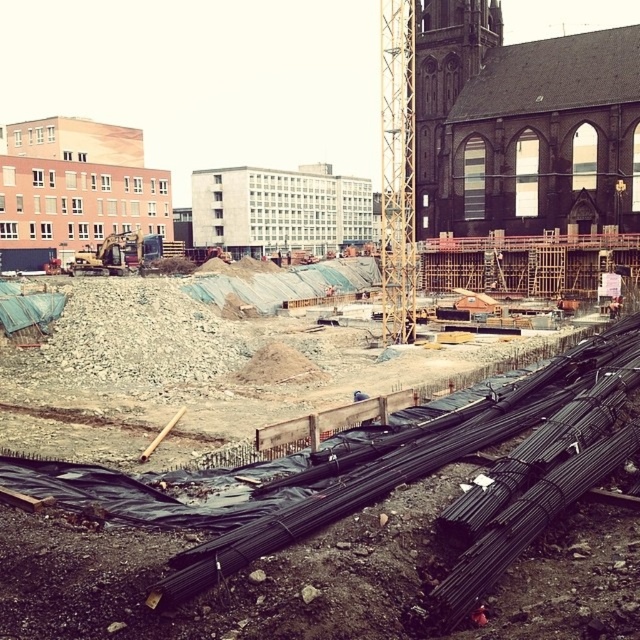
Question: Which of the following is the farthest from the observer?

Choices:
 (A) wooden scaffolding at upper center
 (B) black metal rebar at lower center
 (C) brick building at upper left
 (D) white concrete building at center

Answer: (D)

Question: Does brick building at upper left have a greater width compared to yellow metallic excavator at left?

Choices:
 (A) yes
 (B) no

Answer: (A)

Question: Is brick building at upper left positioned at the back of yellow metallic excavator at left?

Choices:
 (A) yes
 (B) no

Answer: (A)

Question: Can you confirm if dark brown stone church at upper right is positioned to the left of brick building at upper left?

Choices:
 (A) no
 (B) yes

Answer: (A)

Question: Which of these objects is positioned farthest from the dark brown stone church at upper right?

Choices:
 (A) black metal rebar at lower center
 (B) yellow metallic excavator at left
 (C) white concrete building at center

Answer: (C)

Question: Which of the following is the farthest from the observer?

Choices:
 (A) white concrete building at center
 (B) black metal rebar at lower center
 (C) wooden scaffolding at upper center

Answer: (A)